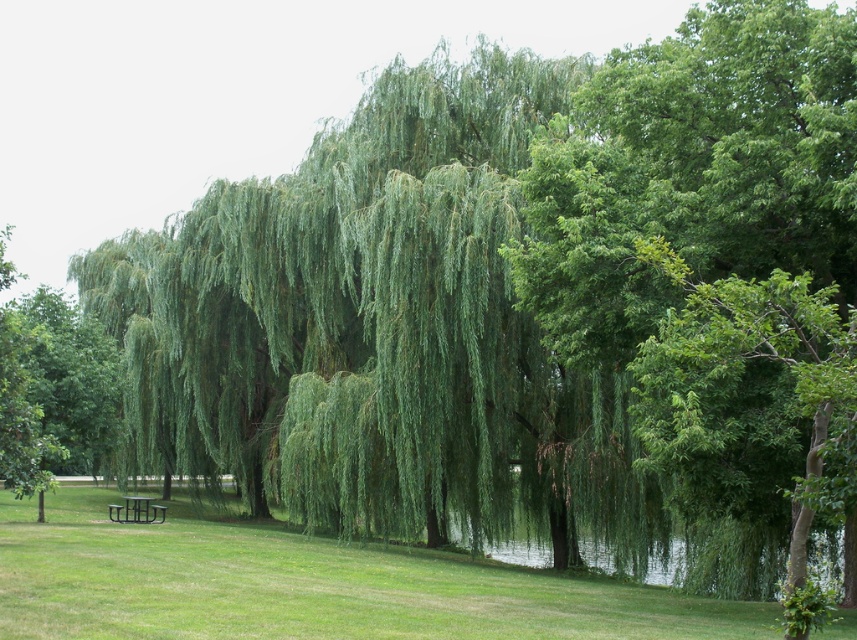
Measure the distance between green grassy at lower center and green metallic picnic table at lower left.

A distance of 9.52 meters exists between green grassy at lower center and green metallic picnic table at lower left.

Is green grassy at lower center taller than green metallic picnic table at lower left?

Answer: Yes.

Image resolution: width=857 pixels, height=640 pixels. Describe the element at coordinates (306, 584) in the screenshot. I see `green grassy at lower center` at that location.

Locate an element on the screen. green grassy at lower center is located at coordinates (306, 584).